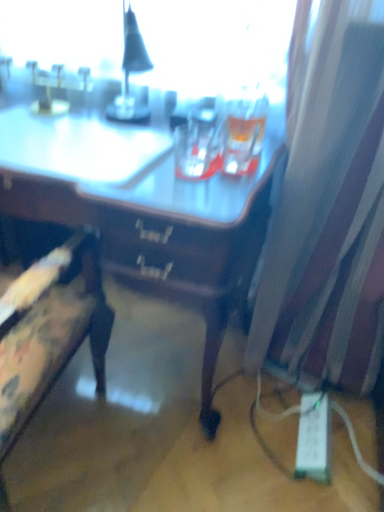
Question: Are floral fabric chair at left and white sheer curtain at right far apart?

Choices:
 (A) yes
 (B) no

Answer: (B)

Question: Can you confirm if floral fabric chair at left is wider than white sheer curtain at right?

Choices:
 (A) yes
 (B) no

Answer: (A)

Question: Is the position of floral fabric chair at left less distant than that of white sheer curtain at right?

Choices:
 (A) no
 (B) yes

Answer: (B)

Question: From a real-world perspective, is floral fabric chair at left on top of white sheer curtain at right?

Choices:
 (A) yes
 (B) no

Answer: (B)

Question: Is white sheer curtain at right located within floral fabric chair at left?

Choices:
 (A) yes
 (B) no

Answer: (B)

Question: Would you say floral fabric chair at left is outside white sheer curtain at right?

Choices:
 (A) yes
 (B) no

Answer: (A)

Question: Is white plastic extension cord at lower right closer to the viewer compared to white sheer curtain at right?

Choices:
 (A) no
 (B) yes

Answer: (A)

Question: From a real-world perspective, is white plastic extension cord at lower right below white sheer curtain at right?

Choices:
 (A) yes
 (B) no

Answer: (A)

Question: Would you consider white plastic extension cord at lower right to be distant from white sheer curtain at right?

Choices:
 (A) no
 (B) yes

Answer: (A)

Question: Is white sheer curtain at right completely or partially inside white plastic extension cord at lower right?

Choices:
 (A) no
 (B) yes

Answer: (A)

Question: Considering the relative sizes of white plastic extension cord at lower right and white sheer curtain at right in the image provided, is white plastic extension cord at lower right thinner than white sheer curtain at right?

Choices:
 (A) no
 (B) yes

Answer: (B)

Question: Is white plastic extension cord at lower right aimed at white sheer curtain at right?

Choices:
 (A) yes
 (B) no

Answer: (B)

Question: Considering the relative sizes of white plastic extension cord at lower right and floral fabric chair at left in the image provided, is white plastic extension cord at lower right taller than floral fabric chair at left?

Choices:
 (A) yes
 (B) no

Answer: (B)